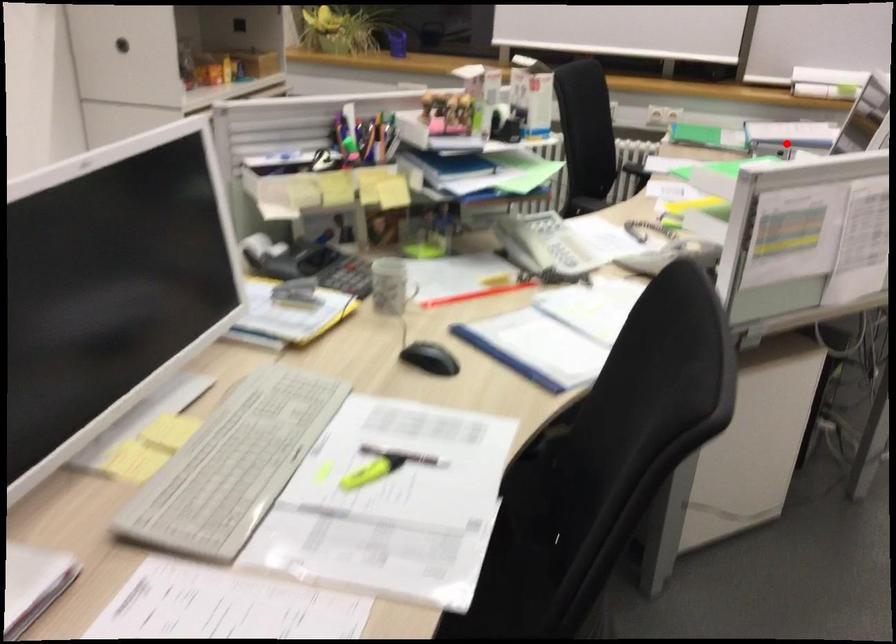
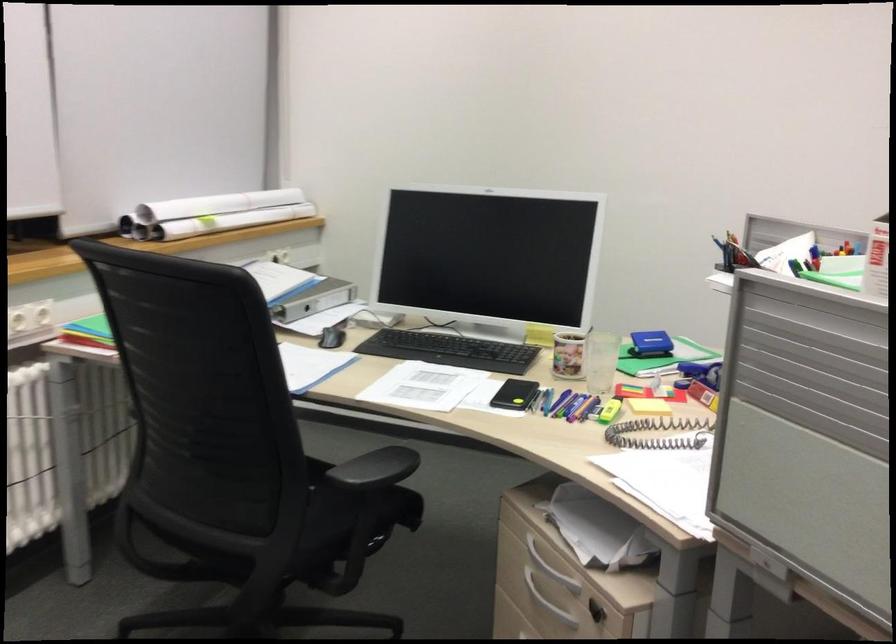
In the second image, find the point that corresponds to the highlighted location in the first image.

(314, 299)